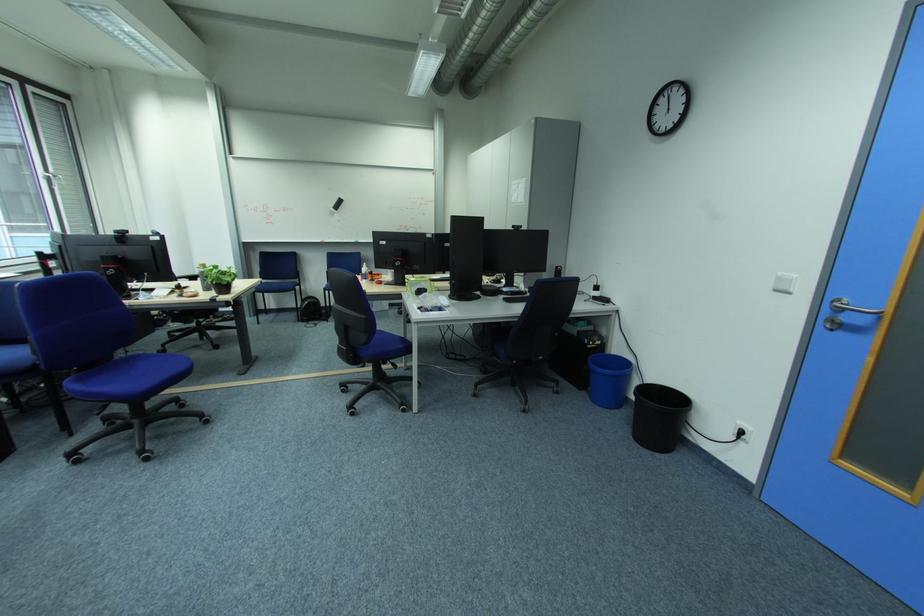
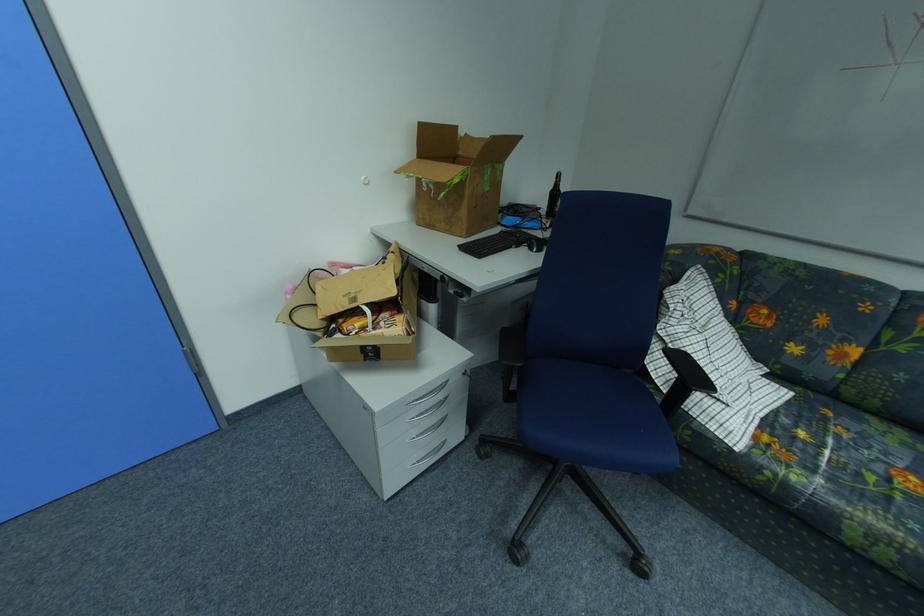
In the scene shown: The images are taken continuously from a first-person perspective. In which direction is your viewpoint rotating?

The rotation direction of the camera is right-down.